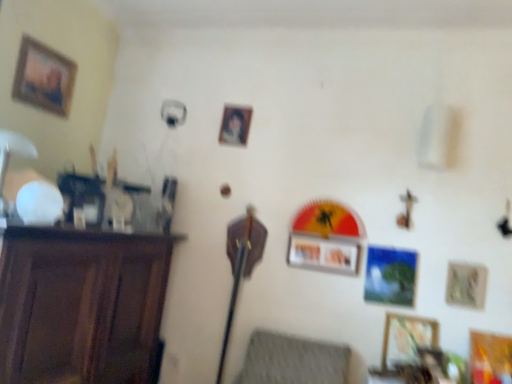
Question: Based on their positions, is dark wood cabinet at left located to the left or right of metallic silver picture frame at lower right, which is counted as the second picture frame, starting from the right?

Choices:
 (A) left
 (B) right

Answer: (A)

Question: Based on their sizes in the image, would you say dark wood cabinet at left is bigger or smaller than metallic silver picture frame at lower right, the fourth picture frame in the top-to-bottom sequence?

Choices:
 (A) big
 (B) small

Answer: (A)

Question: Which object is the farthest from the dark wood cabinet at left?

Choices:
 (A) wooden picture frame at lower right, which appears as the first picture frame when viewed from the right
 (B) wooden framed portrait at upper left, positioned as the first picture frame in left-to-right order
 (C) matte plastic picture frame at center, positioned as the 5th picture frame in right-to-left order
 (D) textured gray cushion at lower center
 (E) wooden picture frame at lower right, the fourth picture frame viewed from the left

Answer: (A)

Question: Considering the real-world distances, which object is closest to the matte plastic picture frame at center, the second picture frame viewed from the left?

Choices:
 (A) textured gray cushion at lower center
 (B) dark wood cabinet at left
 (C) wooden picture frame at lower right, placed as the 2th picture frame when sorted from bottom to top
 (D) wooden framed portrait at upper left, which is counted as the 1th picture frame, starting from the top
 (E) wooden picture frame at lower right, the 6th picture frame when ordered from top to bottom

Answer: (D)